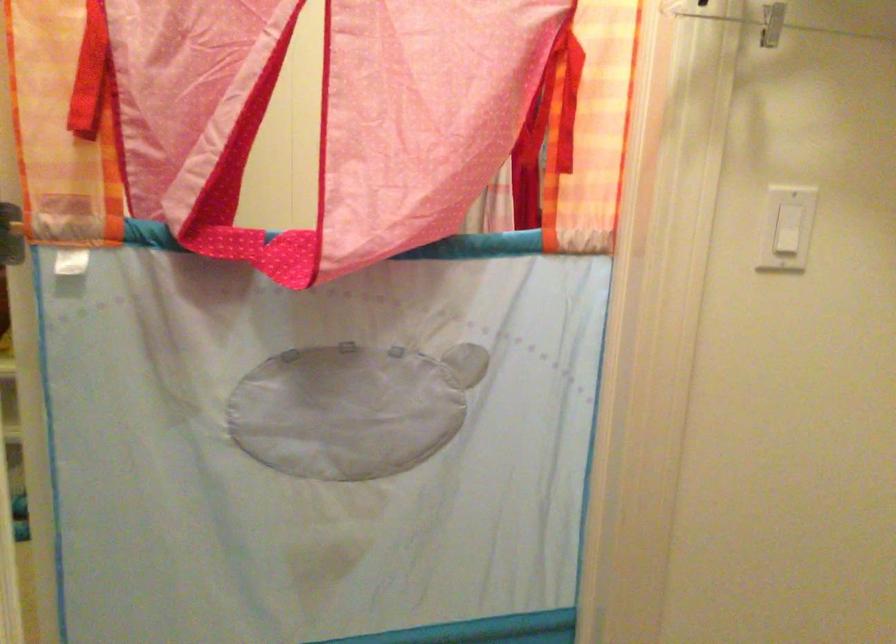
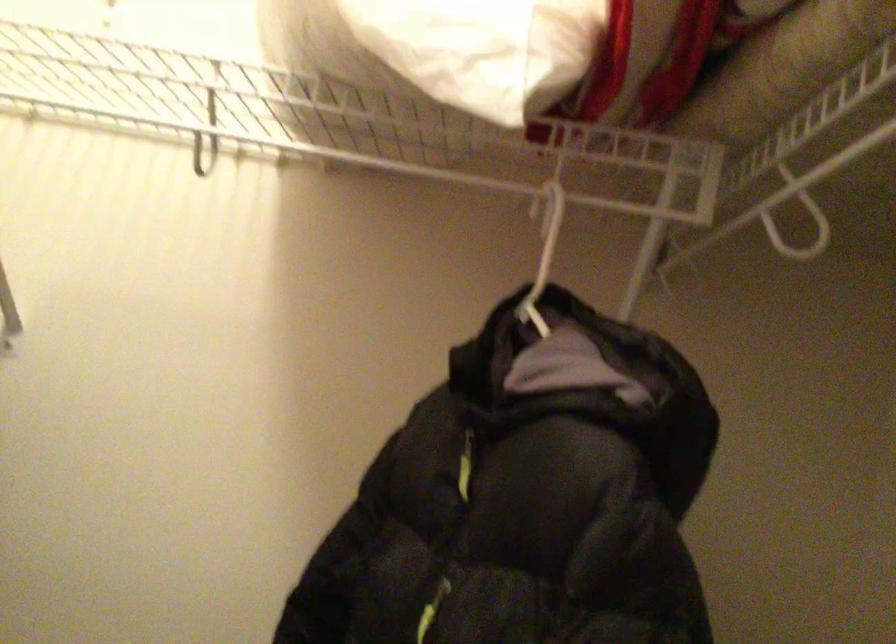
Question: The images are taken continuously from a first-person perspective. In which direction is your viewpoint rotating?

Choices:
 (A) Left
 (B) Right
 (C) Up
 (D) Down

Answer: (B)